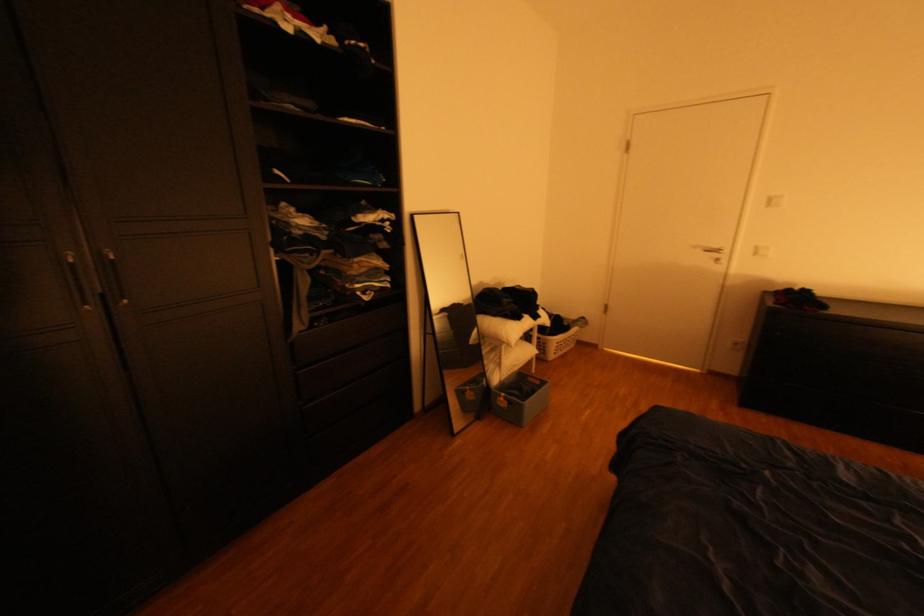
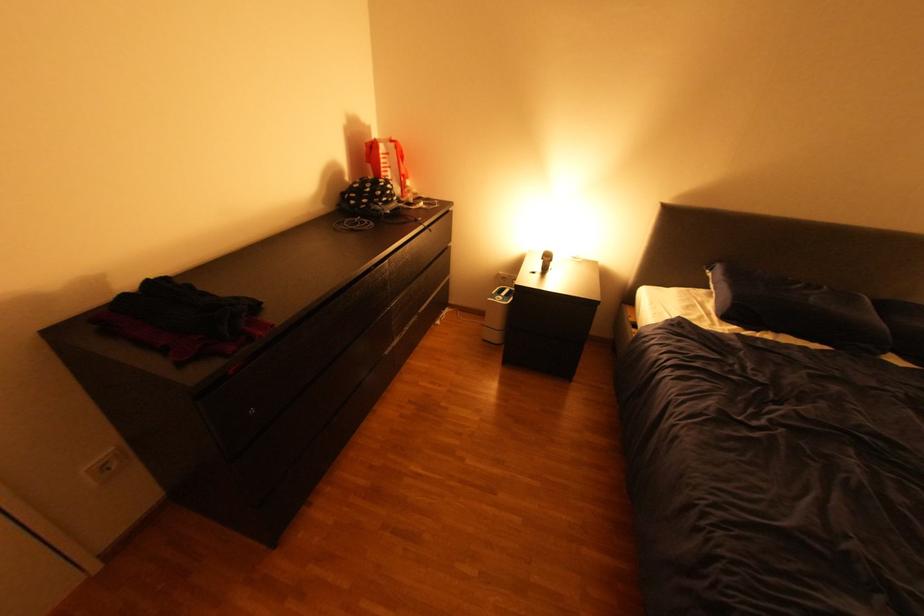
The point at (746,344) is marked in the first image. Where is the corresponding point in the second image?

(114, 467)